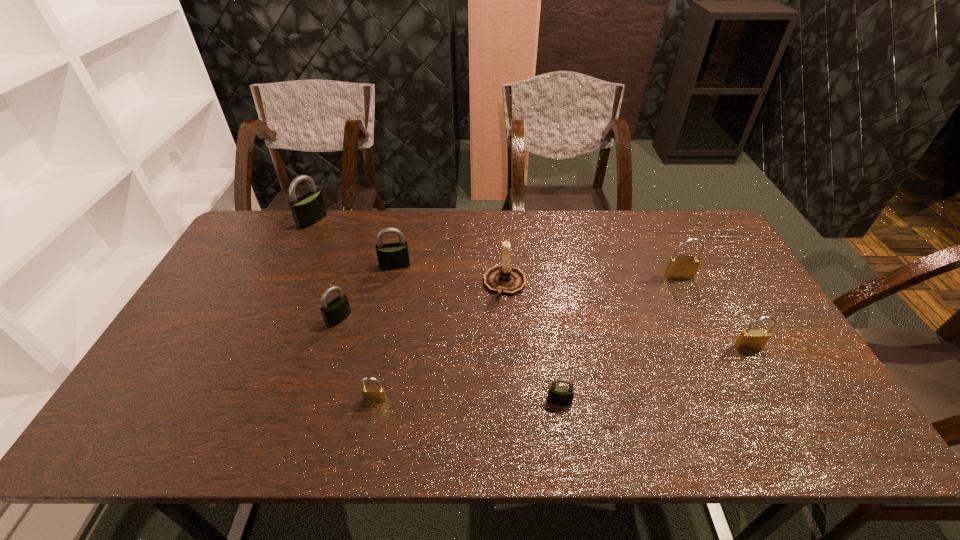
The image size is (960, 540). What are the coordinates of `vacant space located on the right of the second padlock from left to right` in the screenshot? It's located at (460, 319).

Locate an element on the screen. blank space located 0.100m on the front-facing side of the rightmost brass padlock is located at coordinates (768, 383).

The width and height of the screenshot is (960, 540). I want to click on free point located on the back of the sixth object from left to right, so click(544, 301).

At what (x,y) coordinates should I click in order to perform the action: click on free space located 0.070m on the front-facing side of the smallest brass padlock. Please return your answer as a coordinate pair (x, y). This screenshot has height=540, width=960. Looking at the image, I should click on (370, 430).

In order to click on object at the far edge in this screenshot , I will do `click(307, 210)`.

This screenshot has width=960, height=540. I want to click on vacant point at the far edge, so click(x=373, y=212).

This screenshot has width=960, height=540. I want to click on vacant area at the near edge of the desktop, so click(x=617, y=428).

The height and width of the screenshot is (540, 960). In order to click on vacant region at the left edge of the desktop in this screenshot , I will do `click(270, 258)`.

Image resolution: width=960 pixels, height=540 pixels. In the image, there is a desktop. In order to click on vacant space at the right edge in this screenshot , I will do `click(696, 255)`.

What are the coordinates of `vacant area at the far left corner` in the screenshot? It's located at (249, 250).